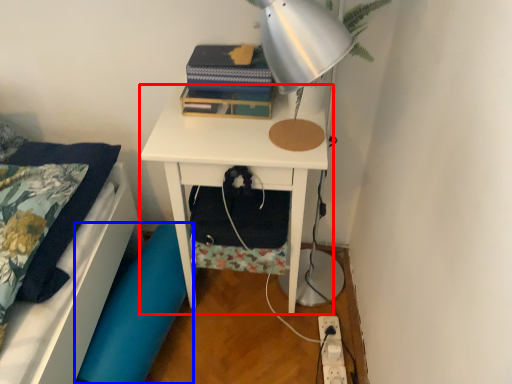
Question: Which point is closer to the camera, nightstand (highlighted by a red box) or swivel chair (highlighted by a blue box)?

Choices:
 (A) nightstand
 (B) swivel chair

Answer: (A)